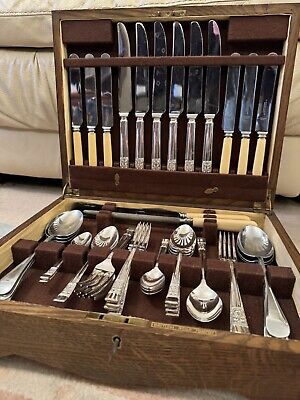
You are a GUI agent. You are given a task and a screenshot of the screen. Output one action in this format:
    pyautogui.click(x=<x>, y=<y>)
    Task: Click on the forks
    Image resolution: width=300 pixels, height=400 pixels.
    Given the screenshot: What is the action you would take?
    pyautogui.click(x=239, y=326), pyautogui.click(x=109, y=295), pyautogui.click(x=109, y=305), pyautogui.click(x=115, y=313), pyautogui.click(x=93, y=285), pyautogui.click(x=92, y=292), pyautogui.click(x=94, y=299)